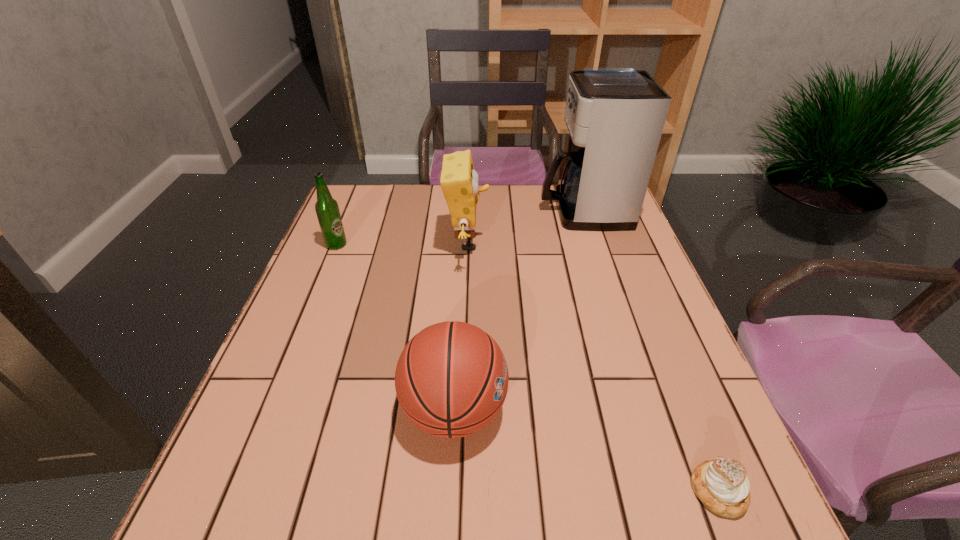
This screenshot has height=540, width=960. What are the coordinates of `object that is at the near right corner` in the screenshot? It's located at (722, 485).

At what (x,y) coordinates should I click in order to perform the action: click on vacant space at the far edge of the desktop. Please return your answer as a coordinate pair (x, y). The image size is (960, 540). Looking at the image, I should click on (421, 199).

I want to click on vacant space at the near edge of the desktop, so click(x=606, y=538).

What are the coordinates of `vacant space at the left edge of the desktop` in the screenshot? It's located at (328, 281).

You are a GUI agent. You are given a task and a screenshot of the screen. Output one action in this format:
    pyautogui.click(x=<x>, y=<y>)
    Task: Click on the vacant space at the right edge
    
    Given the screenshot: What is the action you would take?
    pyautogui.click(x=626, y=272)

Locate an element on the screen. This screenshot has height=540, width=960. free space between the nearest object and the sponge is located at coordinates (592, 367).

At what (x,y) coordinates should I click in order to perform the action: click on free space between the fourth farthest object and the pastry. Please return your answer as a coordinate pair (x, y). The width and height of the screenshot is (960, 540). Looking at the image, I should click on (587, 451).

At what (x,y) coordinates should I click in order to perform the action: click on empty space that is in between the pastry and the tallest object. Please return your answer as a coordinate pair (x, y). Looking at the image, I should click on click(x=651, y=352).

Identify the location of empty space between the shortest object and the sponge. (592, 367).

I want to click on free space between the tallest object and the shortest object, so click(x=651, y=352).